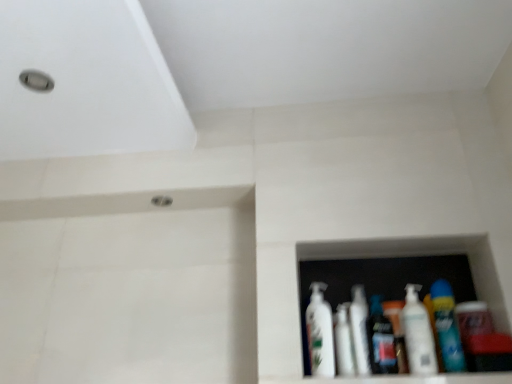
How much space does white plastic bottle at center, arranged as the 3th bottle when viewed from the right, occupy horizontally?

It is 9.05 centimeters.

What is the approximate height of white plastic bottle at center, arranged as the 3th bottle when viewed from the right?

The height of white plastic bottle at center, arranged as the 3th bottle when viewed from the right, is 9.17 inches.

Where is `white glossy bottle at center, the 2th bottle when ordered from right to left`? The image size is (512, 384). white glossy bottle at center, the 2th bottle when ordered from right to left is located at coordinates (418, 334).

What do you see at coordinates (381, 339) in the screenshot?
I see `white glossy lotion at center, which appears as the 2th toiletry when viewed from the right` at bounding box center [381, 339].

I want to click on white glossy bottle at center, which ranks as the 3th bottle in left-to-right order, so click(447, 327).

The width and height of the screenshot is (512, 384). I want to click on white plastic bottle at center, arranged as the 3th bottle when viewed from the right, so click(x=320, y=333).

From the image's perspective, is white glossy mouthwash at center, which is the 1th mouthwash in right-to-left order, under white glossy lotion at center, which appears as the 2th toiletry when viewed from the right?

Correct, white glossy mouthwash at center, which is the 1th mouthwash in right-to-left order, appears lower than white glossy lotion at center, which appears as the 2th toiletry when viewed from the right, in the image.

From a real-world perspective, relative to white glossy lotion at center, placed as the 1th toiletry when sorted from left to right, is white glossy mouthwash at center, acting as the second mouthwash starting from the left, vertically above or below?

In terms of real-world spatial position, white glossy mouthwash at center, acting as the second mouthwash starting from the left, is below white glossy lotion at center, placed as the 1th toiletry when sorted from left to right.

Are white glossy mouthwash at center, acting as the second mouthwash starting from the left, and white glossy lotion at center, which appears as the 2th toiletry when viewed from the right, located far from each other?

No, white glossy mouthwash at center, acting as the second mouthwash starting from the left, is not far from white glossy lotion at center, which appears as the 2th toiletry when viewed from the right.

Does white glossy mouthwash at center, which is the 1th mouthwash in right-to-left order, lie behind white glossy lotion at center, which appears as the 2th toiletry when viewed from the right?

Yes, it is behind white glossy lotion at center, which appears as the 2th toiletry when viewed from the right.

Identify the location of mouthwash that appears below the white glossy bottle at center, which is the second mouthwash in right-to-left order (from a real-world perspective). (359, 330).

Who is smaller, white glossy mouthwash at center, acting as the second mouthwash starting from the left, or white glossy bottle at center, which appears as the first mouthwash when viewed from the left?

white glossy bottle at center, which appears as the first mouthwash when viewed from the left, is smaller.

From the image's perspective, is white glossy mouthwash at center, which is the 1th mouthwash in right-to-left order, above or below white glossy bottle at center, which is the second mouthwash in right-to-left order?

Clearly, from the image's perspective, white glossy mouthwash at center, which is the 1th mouthwash in right-to-left order, is above white glossy bottle at center, which is the second mouthwash in right-to-left order.

Is white glossy mouthwash at center, acting as the second mouthwash starting from the left, wider or thinner than white glossy bottle at center, which appears as the first mouthwash when viewed from the left?

white glossy mouthwash at center, acting as the second mouthwash starting from the left, is thinner than white glossy bottle at center, which appears as the first mouthwash when viewed from the left.

From a real-world perspective, is white glossy bottle at center, which is the second mouthwash in right-to-left order, on top of white plastic bottle at center, positioned as the first bottle in left-to-right order?

Incorrect, from a real-world perspective, white glossy bottle at center, which is the second mouthwash in right-to-left order, is lower than white plastic bottle at center, positioned as the first bottle in left-to-right order.

Is white glossy bottle at center, which appears as the first mouthwash when viewed from the left, positioned with its back to white plastic bottle at center, arranged as the 3th bottle when viewed from the right?

That's not correct — white glossy bottle at center, which appears as the first mouthwash when viewed from the left, is not looking away from white plastic bottle at center, arranged as the 3th bottle when viewed from the right.

Is white glossy bottle at center, which is the second mouthwash in right-to-left order, smaller than white plastic bottle at center, positioned as the first bottle in left-to-right order?

Yes.

Considering the sizes of objects white glossy bottle at center, which is the second mouthwash in right-to-left order, and white plastic bottle at center, positioned as the first bottle in left-to-right order, in the image provided, who is shorter, white glossy bottle at center, which is the second mouthwash in right-to-left order, or white plastic bottle at center, positioned as the first bottle in left-to-right order,?

white glossy bottle at center, which is the second mouthwash in right-to-left order.

From the image's perspective, which one is positioned higher, white glossy lotion at center, placed as the 1th toiletry when sorted from left to right, or white glossy ledge at lower right?

From the image's view, white glossy lotion at center, placed as the 1th toiletry when sorted from left to right, is above.

Is white glossy lotion at center, placed as the 1th toiletry when sorted from left to right, oriented away from white glossy ledge at lower right?

No, white glossy lotion at center, placed as the 1th toiletry when sorted from left to right, is not facing the opposite direction of white glossy ledge at lower right.

Between white glossy lotion at center, which appears as the 2th toiletry when viewed from the right, and white glossy ledge at lower right, which one has larger width?

Wider between the two is white glossy ledge at lower right.

From a real-world perspective, is white glossy bottle at center, which appears as the first mouthwash when viewed from the left, physically above white glossy bottle at center, acting as the second toiletry starting from the left?

Yes, from a real-world perspective, white glossy bottle at center, which appears as the first mouthwash when viewed from the left, is above white glossy bottle at center, acting as the second toiletry starting from the left.

Considering the relative positions of white glossy bottle at center, which is the second mouthwash in right-to-left order, and white glossy bottle at center, acting as the second toiletry starting from the left, in the image provided, is white glossy bottle at center, which is the second mouthwash in right-to-left order, to the left or to the right of white glossy bottle at center, acting as the second toiletry starting from the left,?

Based on their positions, white glossy bottle at center, which is the second mouthwash in right-to-left order, is located to the left of white glossy bottle at center, acting as the second toiletry starting from the left.

Between white glossy bottle at center, which appears as the first mouthwash when viewed from the left, and white glossy bottle at center, acting as the second toiletry starting from the left, which one has smaller width?

With smaller width is white glossy bottle at center, acting as the second toiletry starting from the left.

Is point (337, 312) less distant than point (398, 351)?

That is False.

Which of these two, white glossy ledge at lower right or white glossy bottle at center, which is the second mouthwash in right-to-left order, stands shorter?

white glossy ledge at lower right is shorter.

Is point (305, 378) positioned in front of point (349, 354)?

No, it is behind (349, 354).

Is white glossy ledge at lower right directly adjacent to white glossy bottle at center, which is the second mouthwash in right-to-left order?

No, white glossy ledge at lower right is not making contact with white glossy bottle at center, which is the second mouthwash in right-to-left order.

Is white glossy ledge at lower right facing away from white glossy bottle at center, which is the second mouthwash in right-to-left order?

No, white glossy ledge at lower right's orientation is not away from white glossy bottle at center, which is the second mouthwash in right-to-left order.

From the image's perspective, is white glossy ledge at lower right positioned above or below white glossy bottle at center, the 2th bottle when ordered from left to right?

From the image's perspective, white glossy ledge at lower right appears below white glossy bottle at center, the 2th bottle when ordered from left to right.

Is white glossy ledge at lower right positioned with its back to white glossy bottle at center, the 2th bottle when ordered from left to right?

white glossy ledge at lower right does not have its back to white glossy bottle at center, the 2th bottle when ordered from left to right.

Considering the relative sizes of white glossy ledge at lower right and white glossy bottle at center, the 2th bottle when ordered from left to right, in the image provided, is white glossy ledge at lower right wider than white glossy bottle at center, the 2th bottle when ordered from left to right,?

Yes, white glossy ledge at lower right is wider than white glossy bottle at center, the 2th bottle when ordered from left to right.

From the white glossy ledge at lower right, count 1st bottles backward and point to it. Please provide its 2D coordinates.

[(418, 334)]

From a real-world perspective, starting from the white glossy lotion at center, which appears as the 2th toiletry when viewed from the right, which mouthwash is the 2nd one below it? Please provide its 2D coordinates.

[(359, 330)]

The height and width of the screenshot is (384, 512). Identify the location of mouthwash behind the white glossy mouthwash at center, which is the 1th mouthwash in right-to-left order. (343, 342).

Based on their spatial positions, is white glossy mouthwash at center, acting as the second mouthwash starting from the left, or white glossy bottle at center, acting as the second toiletry starting from the left, further from white plastic bottle at center, positioned as the first bottle in left-to-right order?

Based on the image, white glossy bottle at center, acting as the second toiletry starting from the left, appears to be further to white plastic bottle at center, positioned as the first bottle in left-to-right order.

When comparing their distances from white glossy bottle at center, the 2th bottle when ordered from left to right, does white glossy bottle at center, which is the second mouthwash in right-to-left order, or white plastic bottle at center, positioned as the first bottle in left-to-right order, seem further?

white plastic bottle at center, positioned as the first bottle in left-to-right order, is further to white glossy bottle at center, the 2th bottle when ordered from left to right.

From the image, which object appears to be farther from white glossy mouthwash at center, which is the 1th mouthwash in right-to-left order, white glossy bottle at center, acting as the second toiletry starting from the left, or white glossy bottle at center, which ranks as the 3th bottle in left-to-right order?

white glossy bottle at center, which ranks as the 3th bottle in left-to-right order, is positioned further to the anchor white glossy mouthwash at center, which is the 1th mouthwash in right-to-left order.

When comparing their distances from white glossy bottle at center, which ranks as the 3th bottle in left-to-right order, does white glossy bottle at center, the 2th bottle when ordered from right to left, or white glossy mouthwash at center, which is the 1th mouthwash in right-to-left order, seem further?

white glossy mouthwash at center, which is the 1th mouthwash in right-to-left order, is positioned further to the anchor white glossy bottle at center, which ranks as the 3th bottle in left-to-right order.

Based on their spatial positions, is white glossy ledge at lower right or white glossy mouthwash at center, acting as the second mouthwash starting from the left, closer to white plastic bottle at center, positioned as the first bottle in left-to-right order?

white glossy mouthwash at center, acting as the second mouthwash starting from the left, is closer to white plastic bottle at center, positioned as the first bottle in left-to-right order.

Considering their positions, is white glossy bottle at center, the 2th bottle when ordered from right to left, positioned closer to white glossy bottle at center, which ranks as the 3th bottle in left-to-right order, than white glossy lotion at center, placed as the 1th toiletry when sorted from left to right?

The object closer to white glossy bottle at center, which ranks as the 3th bottle in left-to-right order, is white glossy bottle at center, the 2th bottle when ordered from right to left.

Which object lies nearer to the anchor point white glossy bottle at center, which is the second mouthwash in right-to-left order, white glossy mouthwash at center, acting as the second mouthwash starting from the left, or white glossy bottle at center, which ranks as the 3th bottle in left-to-right order?

white glossy mouthwash at center, acting as the second mouthwash starting from the left, is positioned closer to the anchor white glossy bottle at center, which is the second mouthwash in right-to-left order.

Considering their positions, is white glossy ledge at lower right positioned closer to white glossy bottle at center, which is the second mouthwash in right-to-left order, than white plastic bottle at center, arranged as the 3th bottle when viewed from the right?

white plastic bottle at center, arranged as the 3th bottle when viewed from the right.

Image resolution: width=512 pixels, height=384 pixels. I want to click on mouthwash situated between white plastic bottle at center, positioned as the first bottle in left-to-right order, and white glossy mouthwash at center, which is the 1th mouthwash in right-to-left order, from left to right, so click(x=343, y=342).

Where is `toiletry between white glossy lotion at center, which appears as the 2th toiletry when viewed from the right, and white glossy bottle at center, the 2th bottle when ordered from left to right, from left to right`? Image resolution: width=512 pixels, height=384 pixels. toiletry between white glossy lotion at center, which appears as the 2th toiletry when viewed from the right, and white glossy bottle at center, the 2th bottle when ordered from left to right, from left to right is located at coordinates click(x=397, y=332).

Image resolution: width=512 pixels, height=384 pixels. In order to click on bottle between white glossy bottle at center, which appears as the first mouthwash when viewed from the left, and white glossy bottle at center, the first bottle when ordered from right to left, from left to right in this screenshot , I will do `click(418, 334)`.

Find the location of a particular element. This screenshot has height=384, width=512. mouthwash between white glossy bottle at center, which appears as the first mouthwash when viewed from the left, and white glossy bottle at center, which is counted as the first toiletry, starting from the right, from left to right is located at coordinates (359, 330).